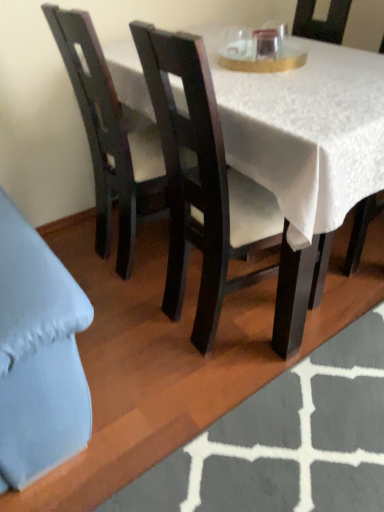
Image resolution: width=384 pixels, height=512 pixels. What are the coordinates of `free space in front of transparent glass at upper center` in the screenshot? It's located at (273, 61).